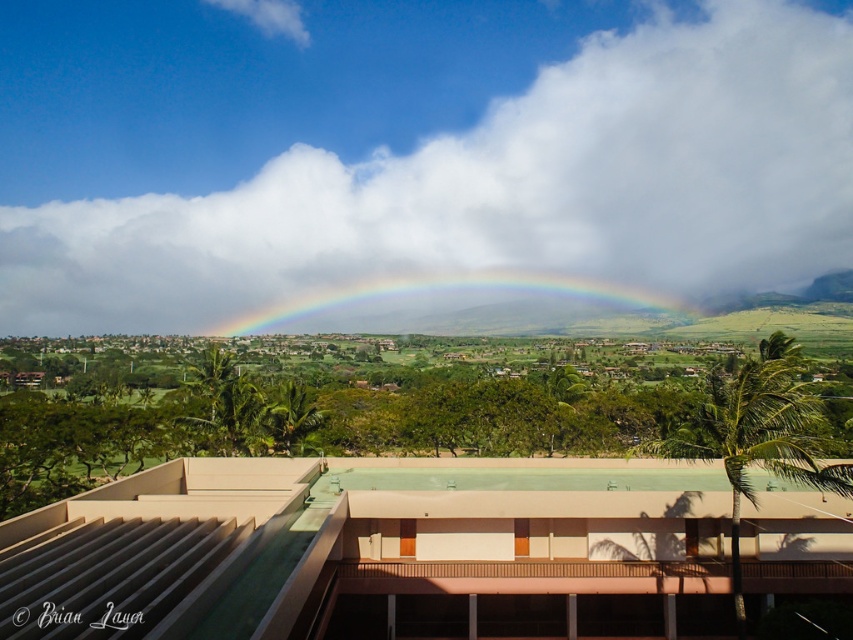
Image resolution: width=853 pixels, height=640 pixels. Describe the element at coordinates (413, 161) in the screenshot. I see `white fluffy cloud at upper center` at that location.

Does point (663, 90) come farther from viewer compared to point (691, 435)?

Yes.

Find the location of a particular element. The image size is (853, 640). white fluffy cloud at upper center is located at coordinates (413, 161).

Looking at this image, can you confirm if rainbow at center is bigger than green leafy palm tree at center-right?

Indeed, rainbow at center has a larger size compared to green leafy palm tree at center-right.

In order to click on rainbow at center in this screenshot , I will do pos(469,307).

What are the coordinates of `rainbow at center` in the screenshot? It's located at (469, 307).

Based on the photo, measure the distance from white fluffy cloud at upper center to rainbow at center.

They are 30.83 meters apart.

Identify the location of white fluffy cloud at upper center. (413, 161).

This screenshot has width=853, height=640. Describe the element at coordinates (413, 161) in the screenshot. I see `white fluffy cloud at upper center` at that location.

The width and height of the screenshot is (853, 640). In order to click on white fluffy cloud at upper center in this screenshot , I will do `click(413, 161)`.